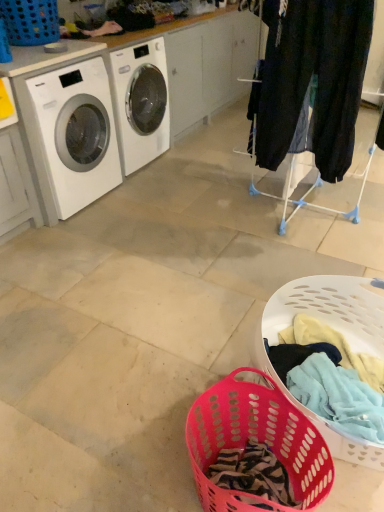
Question: Considering the positions of white glossy washing machine at left and pink plastic laundry basket at lower center, the second basket positioned from the back, in the image, is white glossy washing machine at left wider or thinner than pink plastic laundry basket at lower center, the second basket positioned from the back,?

Choices:
 (A) wide
 (B) thin

Answer: (A)

Question: Looking at the image, does white glossy washing machine at left seem bigger or smaller compared to pink plastic laundry basket at lower center, the second basket positioned from the back?

Choices:
 (A) small
 (B) big

Answer: (B)

Question: Considering the real-world distances, which object is closest to the white glossy washing machine at left?

Choices:
 (A) blue plastic laundry basket at upper left, which is the third basket from bottom to top
 (B) translucent plastic laundry basket at lower center, acting as the 1th basket starting from the bottom
 (C) pink plastic laundry basket at lower center, which ranks as the 2th basket in top-to-bottom order
 (D) dark blue jeans at right

Answer: (A)

Question: Which object is the farthest from the dark blue jeans at right?

Choices:
 (A) translucent plastic laundry basket at lower center, the 1th basket in the front-to-back sequence
 (B) blue plastic laundry basket at upper left, the 1th basket when ordered from top to bottom
 (C) white glossy washing machine at left
 (D) pink plastic laundry basket at lower center, which ranks as the 2th basket in front-to-back order

Answer: (B)